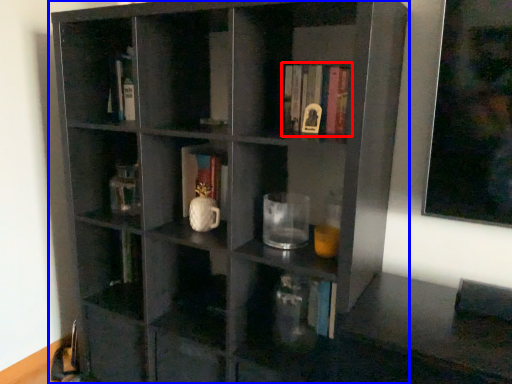
Question: Which of the following is the closest to the observer, book (highlighted by a red box) or shelf (highlighted by a blue box)?

Choices:
 (A) book
 (B) shelf

Answer: (B)